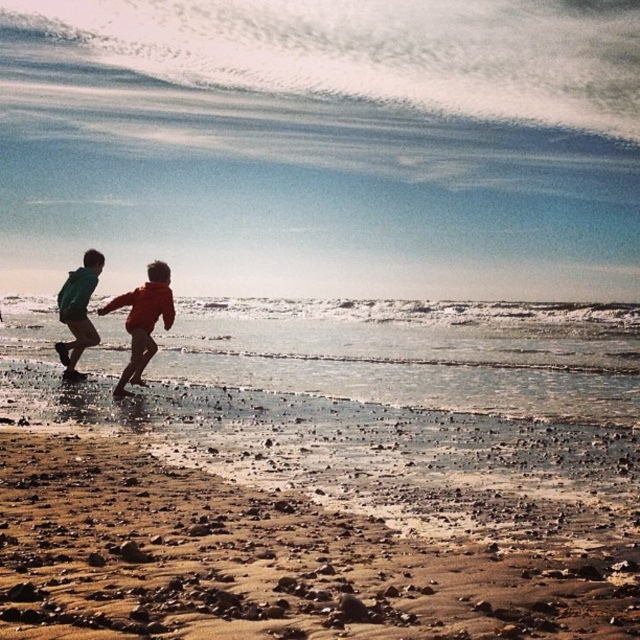
Question: Does brown sandy beach at lower left have a smaller size compared to green matte jacket at left?

Choices:
 (A) yes
 (B) no

Answer: (B)

Question: Estimate the real-world distances between objects in this image. Which object is farther from the brown sandy beach at lower left?

Choices:
 (A) orange fabric child at center
 (B) green matte jacket at left

Answer: (B)

Question: Which point is closer to the camera?

Choices:
 (A) brown sandy beach at lower left
 (B) orange fabric child at center

Answer: (A)

Question: Is orange fabric child at center below green matte jacket at left?

Choices:
 (A) no
 (B) yes

Answer: (A)

Question: Is brown sandy beach at lower left bigger than orange fabric child at center?

Choices:
 (A) no
 (B) yes

Answer: (A)

Question: Estimate the real-world distances between objects in this image. Which object is closer to the green matte jacket at left?

Choices:
 (A) orange fabric child at center
 (B) brown sandy beach at lower left

Answer: (A)